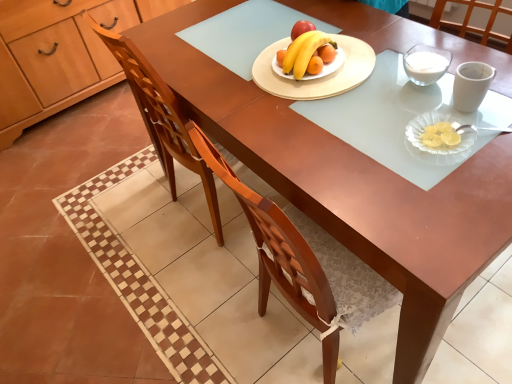
Question: Is yellow matte banana at center smaller than wooden cabinet at left?

Choices:
 (A) yes
 (B) no

Answer: (A)

Question: Is yellow matte banana at center at the left side of wooden cabinet at left?

Choices:
 (A) no
 (B) yes

Answer: (A)

Question: Could you tell me if yellow matte banana at center is turned towards wooden cabinet at left?

Choices:
 (A) yes
 (B) no

Answer: (B)

Question: Is wooden cabinet at left located within yellow matte banana at center?

Choices:
 (A) no
 (B) yes

Answer: (A)

Question: Can you confirm if yellow matte banana at center is thinner than wooden cabinet at left?

Choices:
 (A) yes
 (B) no

Answer: (A)

Question: In the image, is wooden round platter at center, the second platter ordered from the bottom, on the left side or the right side of wooden cabinet at left?

Choices:
 (A) left
 (B) right

Answer: (B)

Question: Looking at their shapes, would you say wooden round platter at center, which is the second platter in front-to-back order, is wider or thinner than wooden cabinet at left?

Choices:
 (A) wide
 (B) thin

Answer: (B)

Question: Is wooden round platter at center, which ranks as the first platter in back-to-front order, inside the boundaries of wooden cabinet at left, or outside?

Choices:
 (A) outside
 (B) inside

Answer: (A)

Question: Is wooden round platter at center, the first platter viewed from the top, in front of or behind wooden cabinet at left in the image?

Choices:
 (A) front
 (B) behind

Answer: (A)

Question: Based on their sizes in the image, would you say yellow matte banana at center is bigger or smaller than clear glass platter at lower right, positioned as the 2th platter in top-to-bottom order?

Choices:
 (A) big
 (B) small

Answer: (A)

Question: Considering the positions of point 315,34 and point 439,117, is point 315,34 closer or farther from the camera than point 439,117?

Choices:
 (A) farther
 (B) closer

Answer: (A)

Question: From the image's perspective, is yellow matte banana at center positioned above or below clear glass platter at lower right, placed as the 1th platter when sorted from right to left?

Choices:
 (A) below
 (B) above

Answer: (B)

Question: Is yellow matte banana at center taller or shorter than clear glass platter at lower right, placed as the 1th platter when sorted from right to left?

Choices:
 (A) tall
 (B) short

Answer: (A)

Question: Relative to wooden cabinet at left, is wooden chair at center in front or behind?

Choices:
 (A) front
 (B) behind

Answer: (A)

Question: Is point (134, 74) closer or farther from the camera than point (19, 66)?

Choices:
 (A) closer
 (B) farther

Answer: (A)